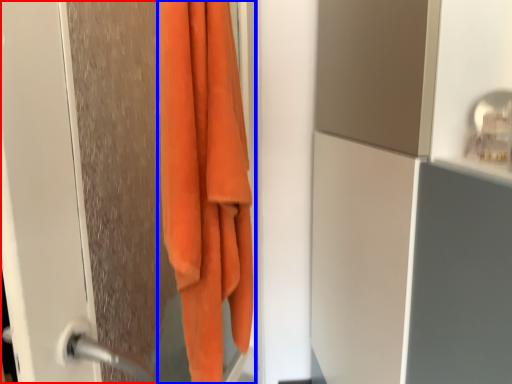
Question: Which of the following is the closest to the observer, screen door (highlighted by a red box) or towel (highlighted by a blue box)?

Choices:
 (A) screen door
 (B) towel

Answer: (A)